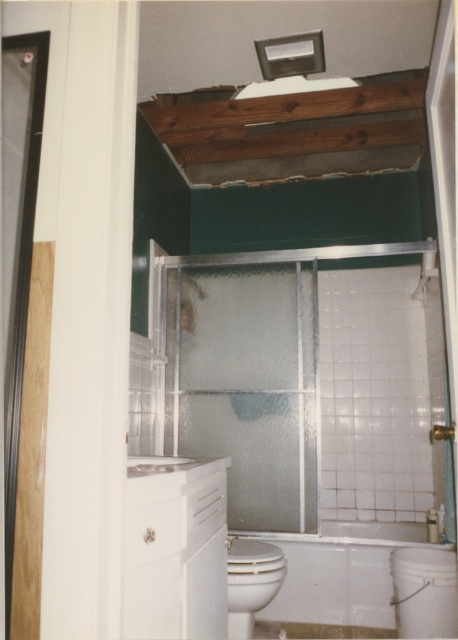
Can you confirm if clear plastic screen door at left is positioned to the right of white glossy toilet bowl at lower center?

No, clear plastic screen door at left is not to the right of white glossy toilet bowl at lower center.

Is clear plastic screen door at left bigger than white glossy toilet bowl at lower center?

No.

The image size is (458, 640). Describe the element at coordinates (17, 241) in the screenshot. I see `clear plastic screen door at left` at that location.

At what (x,y) coordinates should I click in order to perform the action: click on clear plastic screen door at left. Please return your answer as a coordinate pair (x, y). This screenshot has height=640, width=458. Looking at the image, I should click on (17, 241).

Is white glossy bathtub at lower center positioned before white glossy toilet bowl at lower center?

No, white glossy bathtub at lower center is behind white glossy toilet bowl at lower center.

Which is above, white glossy bathtub at lower center or white glossy toilet bowl at lower center?

white glossy toilet bowl at lower center is above.

Is point (338, 552) more distant than point (247, 634)?

Yes.

The width and height of the screenshot is (458, 640). I want to click on white glossy bathtub at lower center, so click(x=338, y=572).

Based on the photo, is frosted glass shower door at center above white glossy toilet bowl at lower center?

Yes.

Which is below, frosted glass shower door at center or white glossy toilet bowl at lower center?

white glossy toilet bowl at lower center is lower down.

Is point (250, 336) positioned before point (265, 579)?

No, (250, 336) is behind (265, 579).

Locate an element on the screen. frosted glass shower door at center is located at coordinates (246, 385).